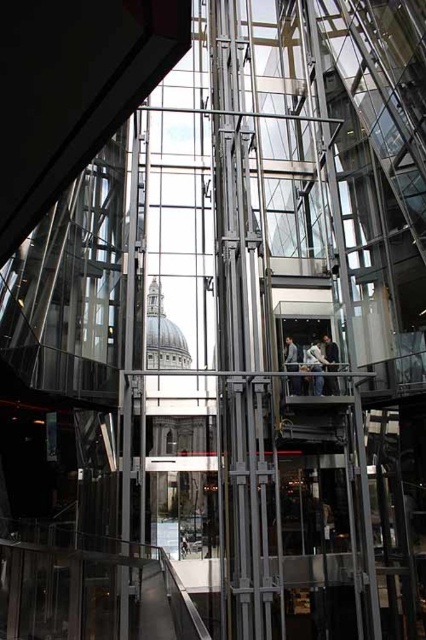
You are a delivery person who needs to place a box between the light beige fabric jacket at center and the dark gray fabric jacket at center. The box requires 6 inches of space. Can you fit it there?

The light beige fabric jacket at center is 6.31 inches away from the dark gray fabric jacket at center, so yes, the box requiring 6 inches of space can fit between them since the distance is sufficient.

You are standing in the modern glass and steel structure and see two jackets hanging at the center. Which jacket is nearer to you, the dark gray fabric jacket at center or the light gray fabric jacket at center?

The dark gray fabric jacket at center is closer to the viewer than the light gray fabric jacket at center, so the dark gray one is nearer.

You are standing in the modern glass and steel structure and see the point marked at coordinates [331,353]. What object is located at that point?

The point at coordinates [331,353] corresponds to the dark gray fabric jacket at center.